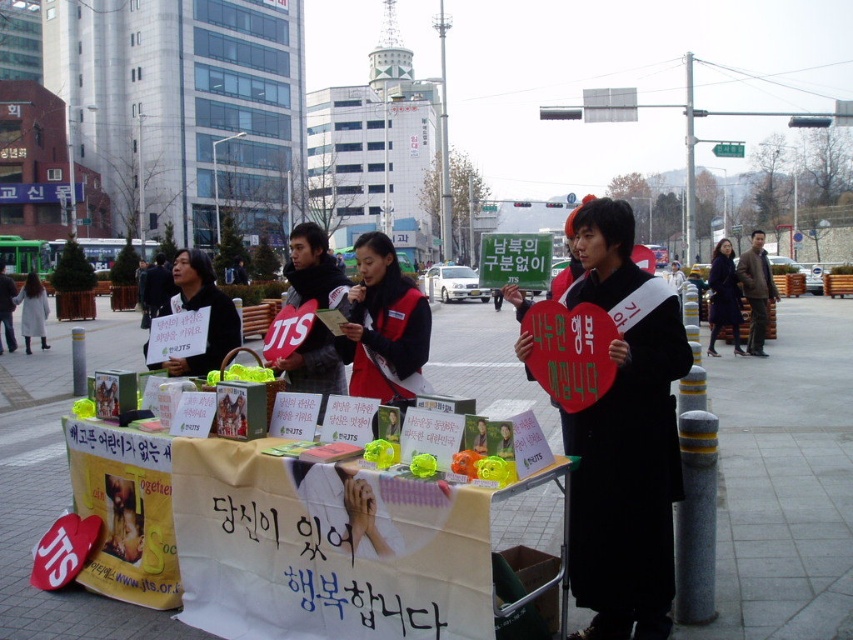
Question: Can you confirm if white fabric table at center is positioned below matte black sign at center?

Choices:
 (A) yes
 (B) no

Answer: (A)

Question: Which is nearer to the white fabric table at center?

Choices:
 (A) matte black cart at center
 (B) matte black sign at center
 (C) black matte coat at center

Answer: (C)

Question: Is matte black cart at center closer to camera compared to white fabric table at center?

Choices:
 (A) yes
 (B) no

Answer: (B)

Question: Which of these objects is positioned farthest from the white fabric table at center?

Choices:
 (A) dark blue wool coat at center
 (B) matte black cart at center
 (C) matte black sign at center
 (D) red fabric vest at center

Answer: (A)

Question: Which of the following is the closest to the observer?

Choices:
 (A) white wool coat at center
 (B) matte black sign at center
 (C) white fabric table at center
 (D) dark blue wool coat at center

Answer: (C)

Question: Can you confirm if white fabric table at center is positioned above white wool coat at center?

Choices:
 (A) no
 (B) yes

Answer: (A)